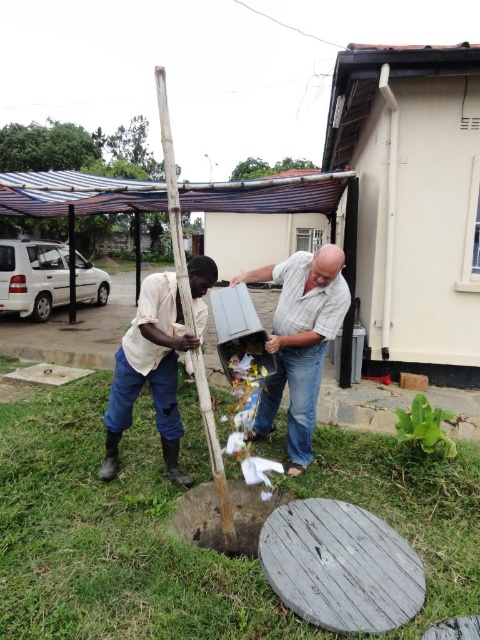
Question: Does matte gray plastic container at center have a larger size compared to light brown fabric shirt at left?

Choices:
 (A) no
 (B) yes

Answer: (A)

Question: Can you confirm if light brown fabric shirt at left is thinner than green leafy tree at upper center?

Choices:
 (A) no
 (B) yes

Answer: (A)

Question: Among these points, which one is farthest from the camera?

Choices:
 (A) (261, 275)
 (B) (141, 179)

Answer: (B)

Question: Considering the real-world distances, which object is closest to the matte gray plastic container at center?

Choices:
 (A) dark brown wood at center
 (B) wooden pole at center
 (C) light brown fabric shirt at left
 (D) wooden cover at center

Answer: (A)

Question: Which object appears farthest from the camera in this image?

Choices:
 (A) light brown fabric shirt at left
 (B) dark brown wood at center
 (C) matte gray plastic container at center

Answer: (C)

Question: Is light brown fabric shirt at left bigger than blue striped canopy at upper left?

Choices:
 (A) no
 (B) yes

Answer: (A)